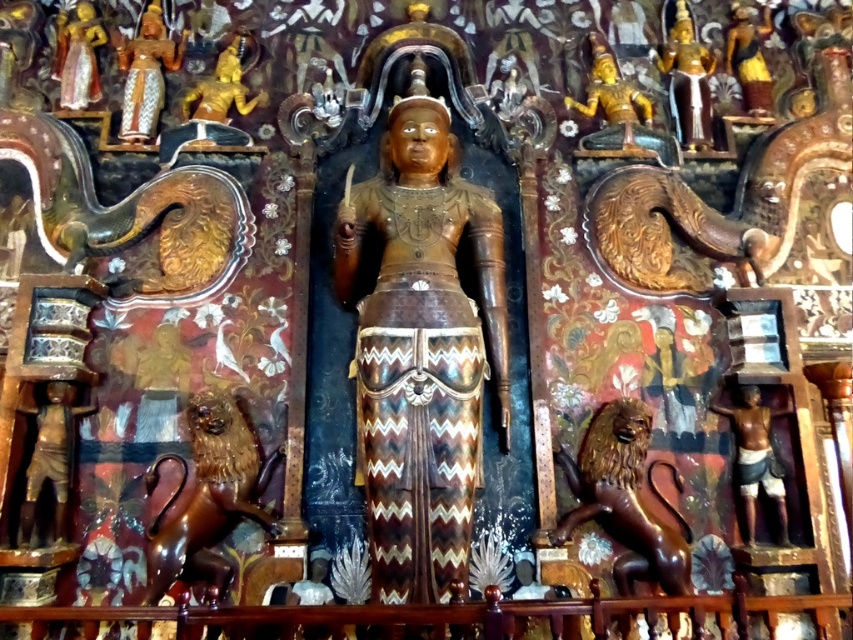
Question: Which object is the farthest from the gold polished statue at upper center?

Choices:
 (A) shiny brown lion at lower left
 (B) bronze figure at lower left

Answer: (B)

Question: Which point is farther from the camera taking this photo?

Choices:
 (A) (227, 404)
 (B) (775, 500)
 (C) (683, 29)

Answer: (C)

Question: Can you confirm if bronze figure at lower right is positioned to the right of bronze figure at lower left?

Choices:
 (A) yes
 (B) no

Answer: (A)

Question: Which object is the farthest from the gold polished statue at upper center?

Choices:
 (A) shiny brown lion at lower left
 (B) bronze figure at lower right

Answer: (A)

Question: Considering the relative positions of bronze figure at lower left and gold polished statue at upper center in the image provided, where is bronze figure at lower left located with respect to gold polished statue at upper center?

Choices:
 (A) below
 (B) above

Answer: (A)

Question: Is the position of shiny brown lion at lower left less distant than that of bronze figure at lower left?

Choices:
 (A) yes
 (B) no

Answer: (A)